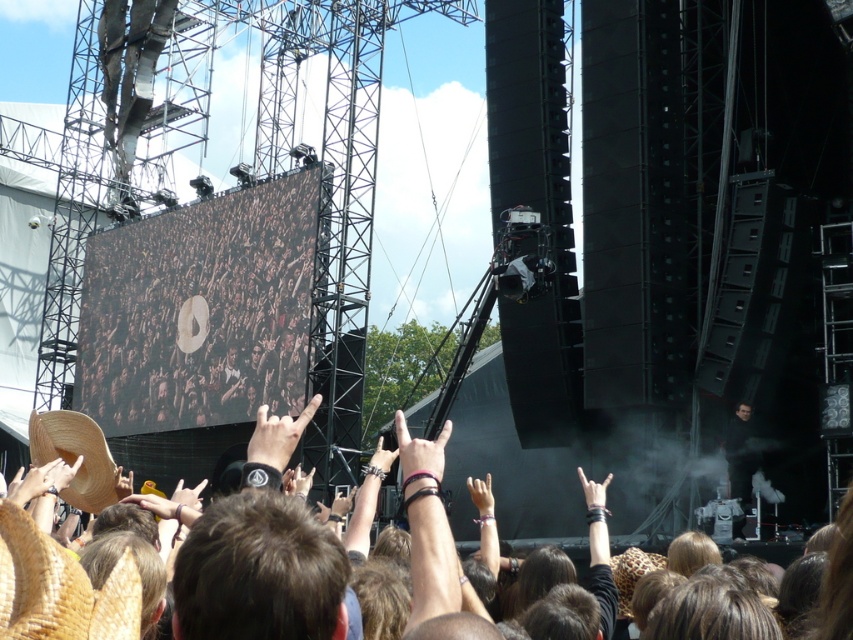
Is the position of brown matte crowd at center less distant than that of brown woven cowboy hat at lower left?

No, it is not.

Looking at this image, is brown matte crowd at center bigger than brown woven cowboy hat at lower left?

Indeed, brown matte crowd at center has a larger size compared to brown woven cowboy hat at lower left.

I want to click on brown matte crowd at center, so click(200, 310).

Is brown matte crowd at center closer to camera compared to natural straw hat at lower left?

No, brown matte crowd at center is behind natural straw hat at lower left.

Which is more to the right, brown matte crowd at center or natural straw hat at lower left?

natural straw hat at lower left

Who is more forward, (302, 198) or (55, 637)?

Positioned in front is point (55, 637).

Image resolution: width=853 pixels, height=640 pixels. What are the coordinates of `brown matte crowd at center` in the screenshot? It's located at (200, 310).

Measure the distance between natural straw hat at lower left and camera.

The distance of natural straw hat at lower left from camera is 173.20 feet.

Is point (54, 604) positioned before point (86, 500)?

That is True.

Identify the location of natural straw hat at lower left. The width and height of the screenshot is (853, 640). (59, 588).

At what (x,y) coordinates should I click in order to perform the action: click on natural straw hat at lower left. Please return your answer as a coordinate pair (x, y). Looking at the image, I should click on (59, 588).